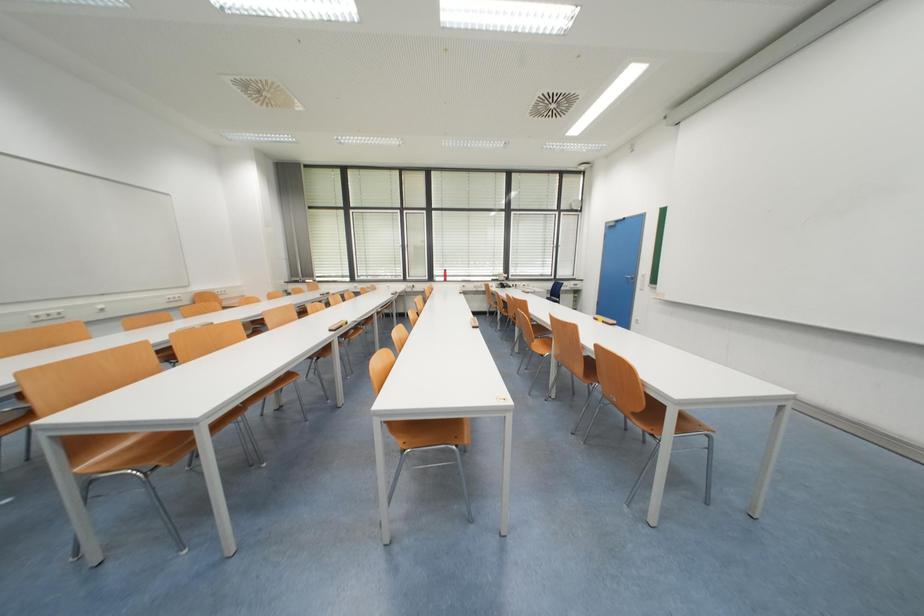
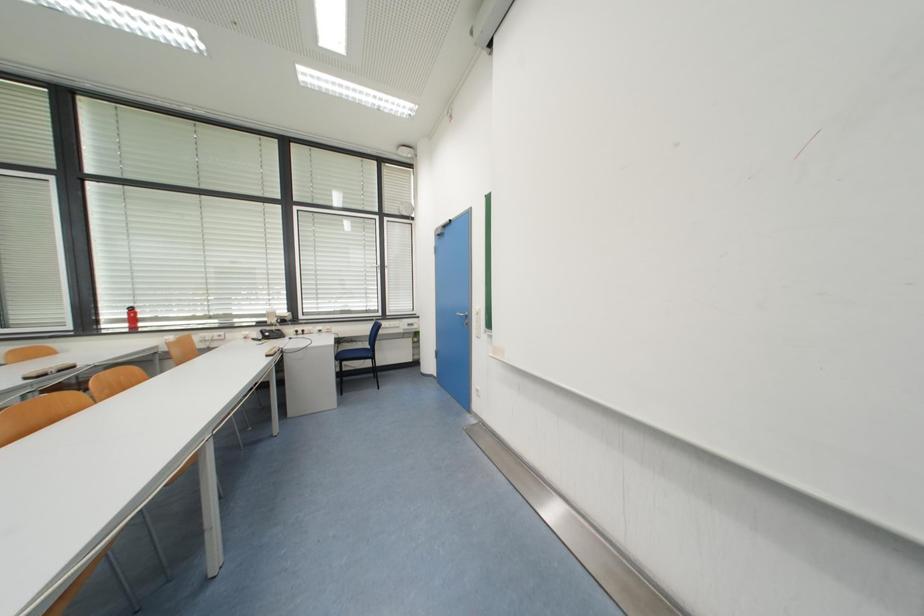
Which direction would the cameraman need to move to produce the second image?

The cameraman moved toward right, forward.